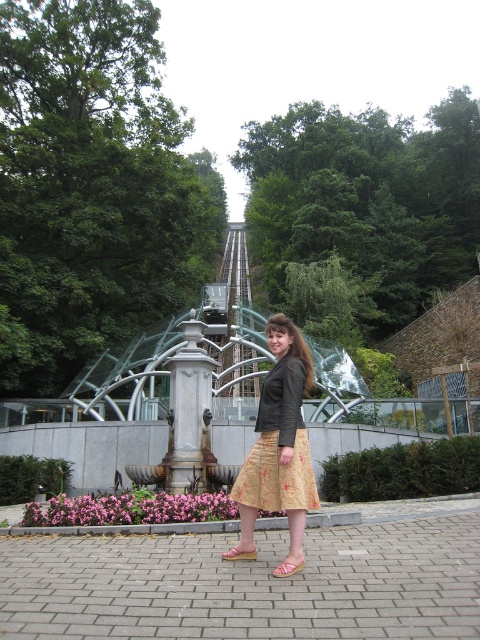
Is white marble fountain at center in front of light brown leather sandal at center?

No.

Which is in front, point (204, 481) or point (226, 552)?

Positioned in front is point (226, 552).

You are a GUI agent. You are given a task and a screenshot of the screen. Output one action in this format:
    pyautogui.click(x=<x>, y=<y>)
    Task: Click on the white marble fountain at center
    This screenshot has height=640, width=480.
    Given the screenshot: What is the action you would take?
    pyautogui.click(x=189, y=413)

Between yellow floral skirt at center and white marble fountain at center, which one appears on the right side from the viewer's perspective?

Positioned to the right is yellow floral skirt at center.

Can you confirm if yellow floral skirt at center is smaller than white marble fountain at center?

Yes.

Measure the distance between yellow floral skirt at center and camera.

26.06 feet

I want to click on yellow floral skirt at center, so click(x=279, y=442).

Who is taller, yellow floral skirt at center or pink fabric sandal at center?

Standing taller between the two is yellow floral skirt at center.

Can you confirm if yellow floral skirt at center is positioned to the left of pink fabric sandal at center?

In fact, yellow floral skirt at center is to the right of pink fabric sandal at center.

Who is more forward, (277, 404) or (286, 563)?

Point (286, 563) is in front.

The image size is (480, 640). Find the location of `yellow floral skirt at center`. yellow floral skirt at center is located at coordinates (279, 442).